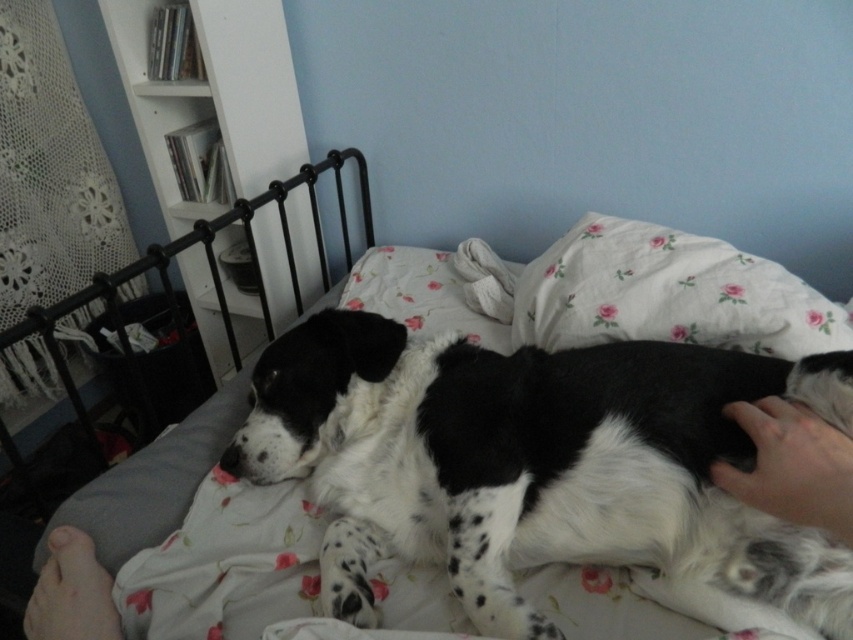
Question: Is spotted fur dog at center further to the viewer compared to fluffy white pillow at upper right?

Choices:
 (A) yes
 (B) no

Answer: (B)

Question: Does spotted fur dog at center have a greater width compared to fluffy white pillow at upper right?

Choices:
 (A) no
 (B) yes

Answer: (B)

Question: Can you confirm if spotted fur dog at center is smaller than fluffy white pillow at upper right?

Choices:
 (A) no
 (B) yes

Answer: (A)

Question: Which point is closer to the camera?

Choices:
 (A) (448, 502)
 (B) (775, 305)

Answer: (A)